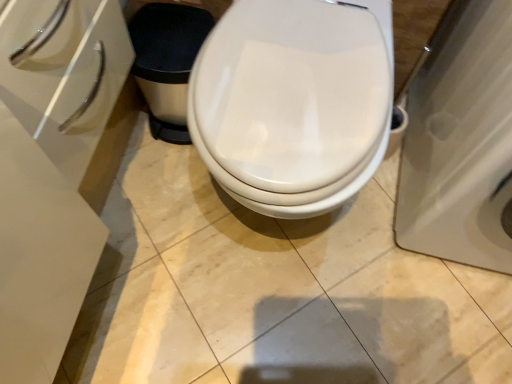
Describe the element at coordinates (460, 141) in the screenshot. The width and height of the screenshot is (512, 384). I see `white glossy porcelain at right` at that location.

Where is `white glossy porcelain at right`? white glossy porcelain at right is located at coordinates (460, 141).

Describe the element at coordinates (294, 102) in the screenshot. I see `white glossy toilet at center` at that location.

The width and height of the screenshot is (512, 384). I want to click on white glossy toilet at center, so click(x=294, y=102).

Where is `white glossy porcelain at right`? white glossy porcelain at right is located at coordinates (460, 141).

Looking at this image, is white glossy toilet at center to the left of white glossy porcelain at right from the viewer's perspective?

Yes, white glossy toilet at center is to the left of white glossy porcelain at right.

From the picture: Is white glossy toilet at center in front of or behind white glossy porcelain at right in the image?

Clearly, white glossy toilet at center is behind white glossy porcelain at right.

Between point (234, 131) and point (446, 19), which one is positioned behind?

The point (446, 19) is farther from the camera.

From the image's perspective, is white glossy toilet at center positioned above or below white glossy porcelain at right?

From the image's perspective, white glossy toilet at center appears below white glossy porcelain at right.

From a real-world perspective, which object stands above the other?

white glossy porcelain at right, from a real-world perspective.

Between white glossy toilet at center and white glossy porcelain at right, which one has smaller width?

white glossy toilet at center is thinner.

Considering the sizes of objects white glossy toilet at center and white glossy porcelain at right in the image provided, who is shorter, white glossy toilet at center or white glossy porcelain at right?

Standing shorter between the two is white glossy toilet at center.

Who is bigger, white glossy toilet at center or white glossy porcelain at right?

white glossy porcelain at right.

Is white glossy toilet at center positioned beyond the bounds of white glossy porcelain at right?

white glossy toilet at center is positioned outside white glossy porcelain at right.

Is white glossy toilet at center not near white glossy porcelain at right?

They are positioned close to each other.

Consider the image. Is white glossy toilet at center aimed at white glossy porcelain at right?

No, white glossy toilet at center is not aimed at white glossy porcelain at right.

The image size is (512, 384). Identify the location of toilet below the white glossy porcelain at right (from a real-world perspective). (294, 102).

Is white glossy porcelain at right at the left side of white glossy toilet at center?

In fact, white glossy porcelain at right is to the right of white glossy toilet at center.

Is white glossy porcelain at right in front of white glossy toilet at center?

Yes, white glossy porcelain at right is closer to the viewer.

Considering the positions of points (505, 5) and (292, 63), is point (505, 5) farther from camera compared to point (292, 63)?

No.

From the image's perspective, who appears lower, white glossy porcelain at right or white glossy toilet at center?

white glossy toilet at center is shown below in the image.

From a real-world perspective, who is located higher, white glossy porcelain at right or white glossy toilet at center?

white glossy porcelain at right, from a real-world perspective.

Which object is thinner, white glossy porcelain at right or white glossy toilet at center?

white glossy toilet at center is thinner.

Considering the relative sizes of white glossy porcelain at right and white glossy toilet at center in the image provided, is white glossy porcelain at right taller than white glossy toilet at center?

Correct, white glossy porcelain at right is much taller as white glossy toilet at center.

Is white glossy porcelain at right bigger than white glossy toilet at center?

Yes.

Is white glossy toilet at center completely or partially inside white glossy porcelain at right?

No, white glossy toilet at center is not a part of white glossy porcelain at right.

Are white glossy porcelain at right and white glossy toilet at center far apart?

No.

Is white glossy porcelain at right aimed at white glossy toilet at center?

No, white glossy porcelain at right is not facing towards white glossy toilet at center.

How far apart are white glossy porcelain at right and white glossy toilet at center?

white glossy porcelain at right and white glossy toilet at center are 26.79 centimeters apart.

Locate an element on the screen. This screenshot has height=384, width=512. toilet behind the white glossy porcelain at right is located at coordinates (294, 102).

Where is `porcelain in front of the white glossy toilet at center`? porcelain in front of the white glossy toilet at center is located at coordinates (460, 141).

What are the coordinates of `toilet to the left of white glossy porcelain at right` in the screenshot? It's located at (294, 102).